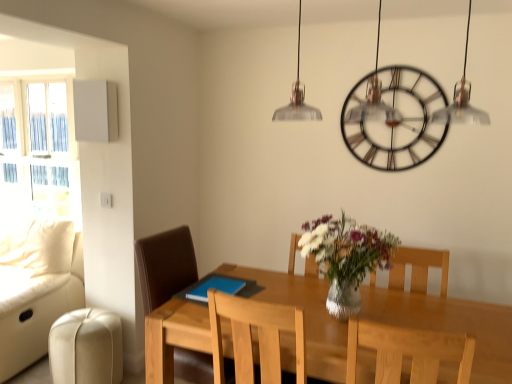
This screenshot has height=384, width=512. What are the coordinates of `empty space that is ontop of metallic/brass-toned clock at upper center (from a real-world perspective)` in the screenshot? It's located at (402, 69).